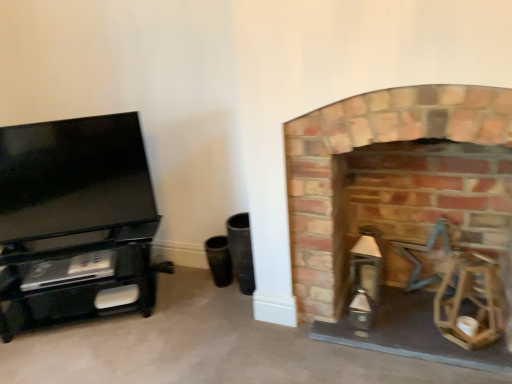
Question: Is black glossy tv stand at left touching brick fireplace at right?

Choices:
 (A) no
 (B) yes

Answer: (A)

Question: Would you say black glossy tv stand at left is a long distance from brick fireplace at right?

Choices:
 (A) no
 (B) yes

Answer: (B)

Question: Is black glossy tv stand at left completely or partially outside of brick fireplace at right?

Choices:
 (A) no
 (B) yes

Answer: (B)

Question: Considering the relative sizes of black glossy tv stand at left and brick fireplace at right in the image provided, is black glossy tv stand at left taller than brick fireplace at right?

Choices:
 (A) no
 (B) yes

Answer: (A)

Question: Can you confirm if black glossy tv stand at left is wider than brick fireplace at right?

Choices:
 (A) no
 (B) yes

Answer: (A)

Question: Is black glossy tv stand at left further to the viewer compared to brick fireplace at right?

Choices:
 (A) yes
 (B) no

Answer: (A)

Question: Would you say black glossy tv stand at left is part of brick fireplace at right's contents?

Choices:
 (A) no
 (B) yes

Answer: (A)

Question: Is brick fireplace at right wider than black glossy tv stand at left?

Choices:
 (A) no
 (B) yes

Answer: (B)

Question: Is brick fireplace at right aimed at black glossy tv stand at left?

Choices:
 (A) yes
 (B) no

Answer: (B)

Question: Is brick fireplace at right in contact with black glossy tv stand at left?

Choices:
 (A) yes
 (B) no

Answer: (B)

Question: Is black glossy tv stand at left at the back of brick fireplace at right?

Choices:
 (A) no
 (B) yes

Answer: (A)

Question: From a real-world perspective, does brick fireplace at right sit lower than black glossy tv stand at left?

Choices:
 (A) no
 (B) yes

Answer: (B)

Question: From a real-world perspective, is brick fireplace at right physically located above or below black glossy tv stand at left?

Choices:
 (A) above
 (B) below

Answer: (B)